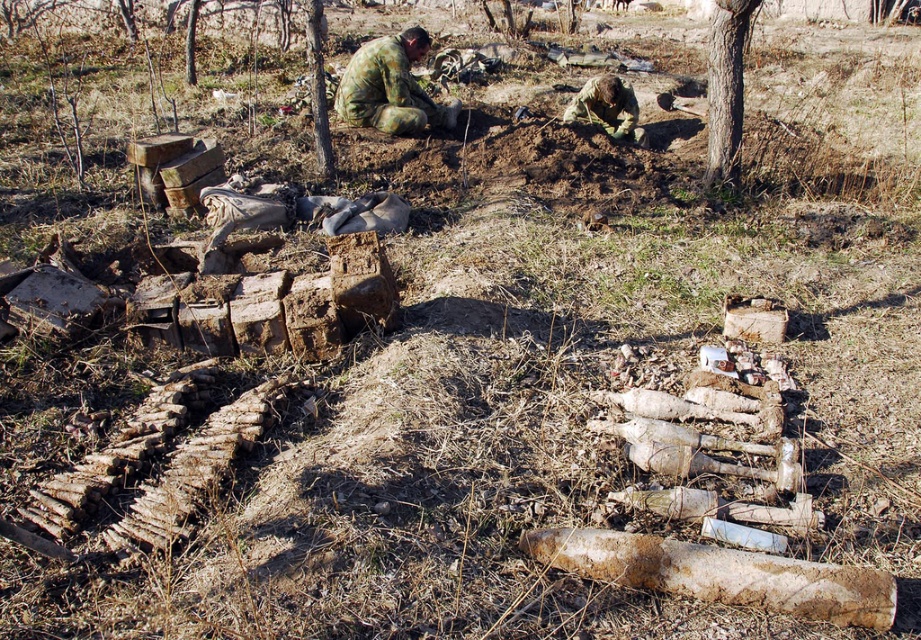
Does camouflage fabric soldier at center have a lesser width compared to brown bark tree at center?

In fact, camouflage fabric soldier at center might be wider than brown bark tree at center.

Is point (634, 125) closer to camera compared to point (315, 93)?

No, it is not.

Is point (615, 99) closer to camera compared to point (313, 38)?

No, (615, 99) is further to viewer.

At what (x,y) coordinates should I click in order to perform the action: click on camouflage fabric soldier at center. Please return your answer as a coordinate pair (x, y). Looking at the image, I should click on (607, 108).

From the picture: Is brown rough log at lower right thinner than camouflage fabric uniform at center?

Indeed, brown rough log at lower right has a lesser width compared to camouflage fabric uniform at center.

Identify the location of brown rough log at lower right. (720, 573).

You are a GUI agent. You are given a task and a screenshot of the screen. Output one action in this format:
    pyautogui.click(x=<x>, y=<y>)
    Task: Click on the brown rough log at lower right
    This screenshot has height=640, width=921.
    Given the screenshot: What is the action you would take?
    pyautogui.click(x=720, y=573)

Does camouflage fabric uniform at center come behind brown bark tree at center?

That is True.

Does camouflage fabric uniform at center have a smaller size compared to brown bark tree at center?

Incorrect, camouflage fabric uniform at center is not smaller in size than brown bark tree at center.

Does point (370, 90) come in front of point (316, 26)?

No.

Identify the location of camouflage fabric uniform at center. This screenshot has height=640, width=921. (391, 88).